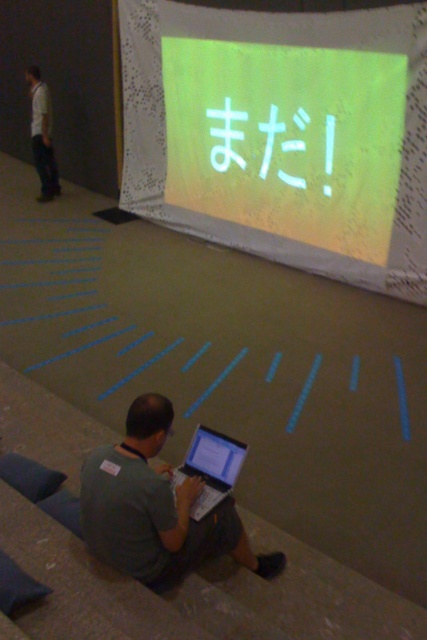
Question: Based on their relative distances, which object is nearer to the matte black laptop at center?

Choices:
 (A) light gray shirt at left
 (B) matte yellow fabric at upper center
 (C) green matte laptop at lower center

Answer: (C)

Question: Observing the image, what is the correct spatial positioning of matte black laptop at center in reference to light gray shirt at left?

Choices:
 (A) below
 (B) above

Answer: (A)

Question: In this image, where is matte silver laptop at lower center located relative to light gray shirt at left?

Choices:
 (A) above
 (B) below

Answer: (B)

Question: Is matte yellow fabric at upper center smaller than white matte text at upper center?

Choices:
 (A) yes
 (B) no

Answer: (B)

Question: Which point is closer to the camera taking this photo?

Choices:
 (A) (330, 138)
 (B) (26, 74)
 (C) (222, 465)
 (D) (210, 218)

Answer: (C)

Question: Which of the following is the closest to the observer?

Choices:
 (A) (315, 38)
 (B) (213, 474)
 (C) (224, 454)

Answer: (B)